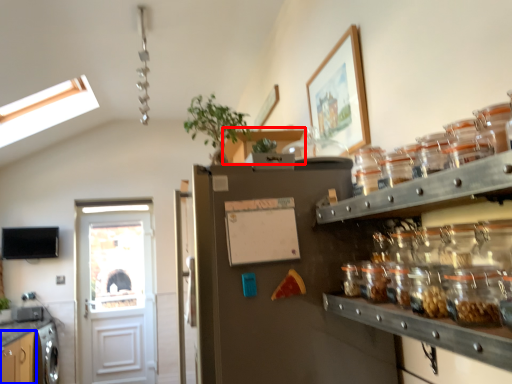
Question: Which object appears closest to the camera in this image, cabinetry (highlighted by a red box) or cabinetry (highlighted by a blue box)?

Choices:
 (A) cabinetry
 (B) cabinetry

Answer: (A)